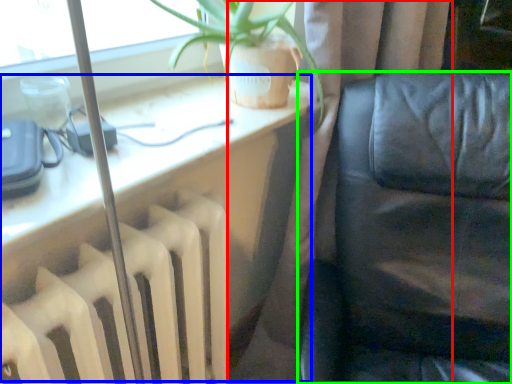
Question: Which object is positioned closest to curtain (highlighted by a red box)? Select from computer desk (highlighted by a blue box) and furniture (highlighted by a green box).

Choices:
 (A) computer desk
 (B) furniture

Answer: (B)